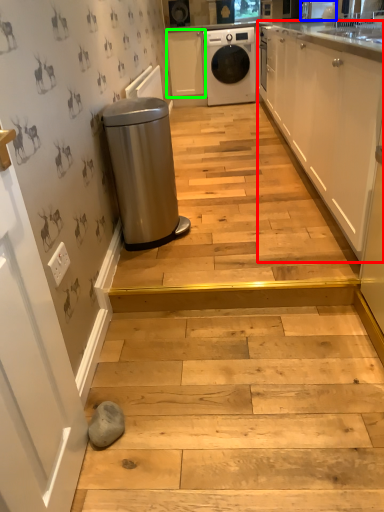
Question: Which object is positioned closest to cabinetry (highlighted by a red box)? Select from appliance (highlighted by a blue box) and cabinetry (highlighted by a green box).

Choices:
 (A) appliance
 (B) cabinetry

Answer: (A)